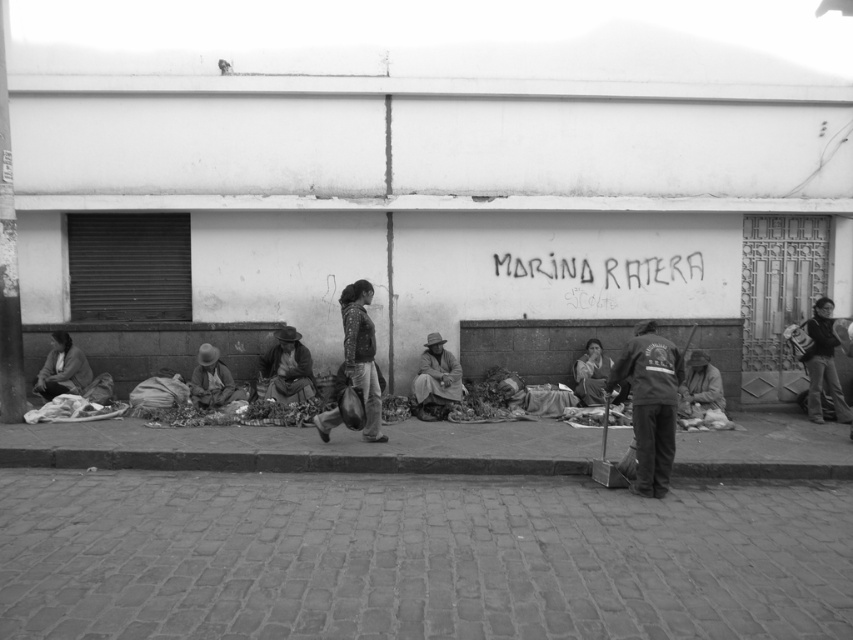
Between smooth concrete curb at lower center and matte brown hat at lower left, which one has more height?

matte brown hat at lower left is taller.

This screenshot has height=640, width=853. Describe the element at coordinates (285, 461) in the screenshot. I see `smooth concrete curb at lower center` at that location.

Locate an element on the screen. smooth concrete curb at lower center is located at coordinates (285, 461).

This screenshot has height=640, width=853. Find the location of `smooth concrete curb at lower center`. smooth concrete curb at lower center is located at coordinates (285, 461).

Can you confirm if matte brown hat at lower left is shorter than dark gray fabric at lower right?

Yes, matte brown hat at lower left is shorter than dark gray fabric at lower right.

At what (x,y) coordinates should I click in order to perform the action: click on matte brown hat at lower left. Please return your answer as a coordinate pair (x, y). This screenshot has width=853, height=640. Looking at the image, I should click on (212, 380).

This screenshot has height=640, width=853. Find the location of `matte brown hat at lower left`. matte brown hat at lower left is located at coordinates (212, 380).

Is smooth concrete curb at lower center smaller than brown woven hat at center?

Yes.

This screenshot has width=853, height=640. Describe the element at coordinates (285, 461) in the screenshot. I see `smooth concrete curb at lower center` at that location.

Locate an element on the screen. This screenshot has width=853, height=640. smooth concrete curb at lower center is located at coordinates (285, 461).